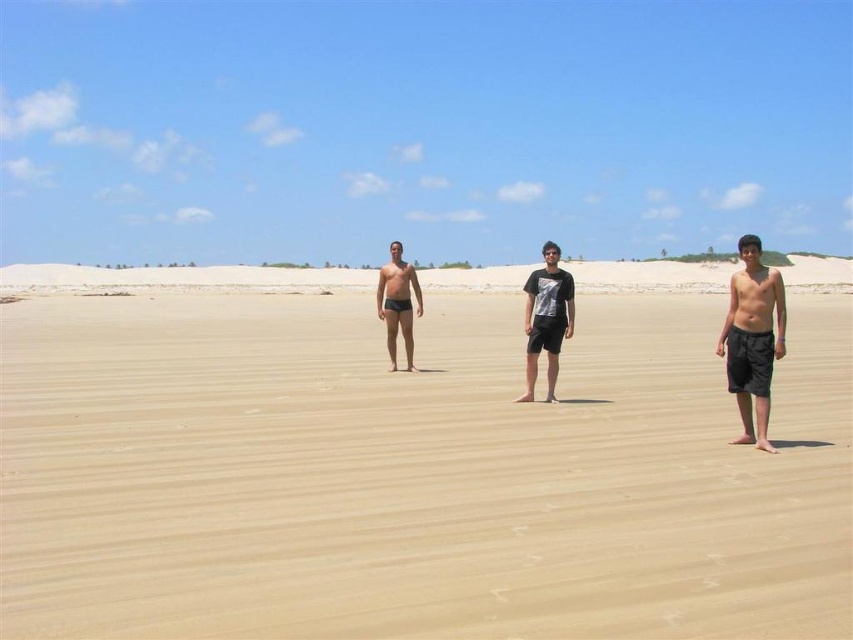
Can you confirm if silver metallic t-shirt at center is wider than matte black swim trunks at center?

Yes, silver metallic t-shirt at center is wider than matte black swim trunks at center.

Who is higher up, silver metallic t-shirt at center or matte black swim trunks at center?

matte black swim trunks at center

I want to click on silver metallic t-shirt at center, so click(546, 317).

The height and width of the screenshot is (640, 853). I want to click on silver metallic t-shirt at center, so click(x=546, y=317).

Does black matte shorts at right have a lesser height compared to silver metallic t-shirt at center?

In fact, black matte shorts at right may be taller than silver metallic t-shirt at center.

Which is in front, point (728, 340) or point (553, 332)?

Positioned in front is point (728, 340).

Identify the location of black matte shorts at right. The image size is (853, 640). (752, 339).

Does smooth tan sand at center have a lesser height compared to silver metallic t-shirt at center?

Yes.

Between point (393, 397) and point (538, 316), which one is positioned behind?

Point (393, 397)

This screenshot has width=853, height=640. I want to click on smooth tan sand at center, so [412, 474].